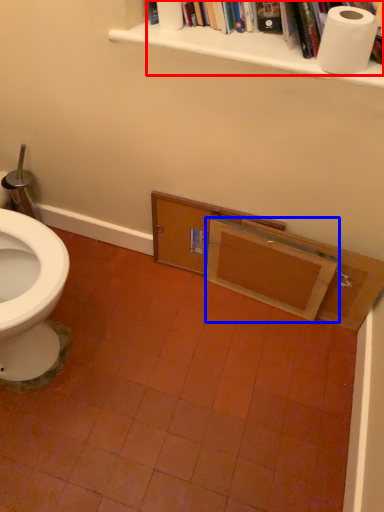
Question: Among these objects, which one is nearest to the camera, book (highlighted by a red box) or drawer (highlighted by a blue box)?

Choices:
 (A) book
 (B) drawer

Answer: (A)